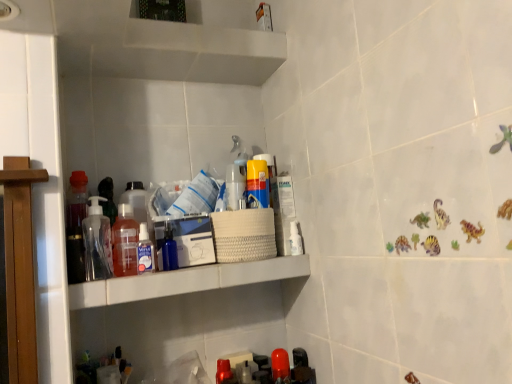
This screenshot has height=384, width=512. I want to click on empty space that is ontop of white plastic shelf at upper center (from a real-world perspective), so click(x=188, y=266).